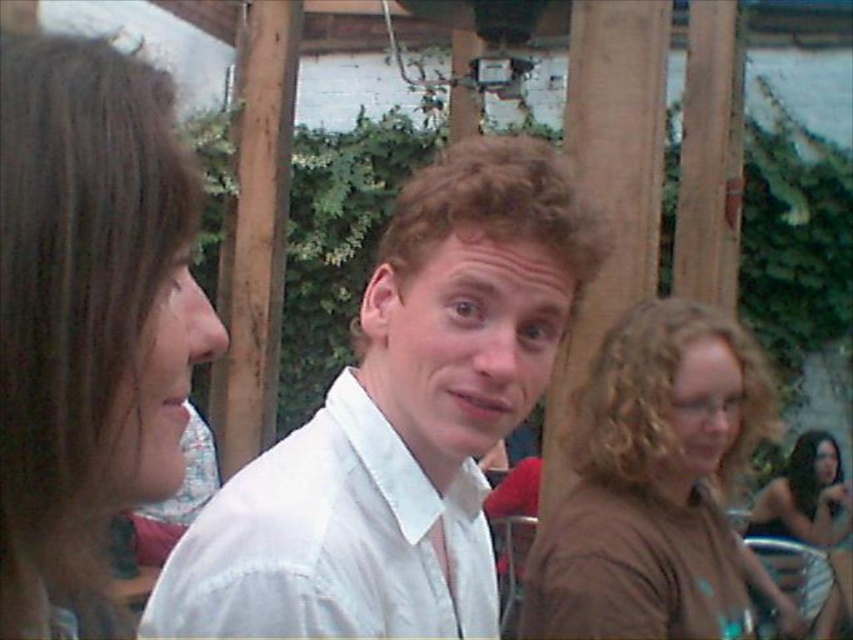
Is brown hair at left further to camera compared to brown matte shirt at center?

No, it is not.

Is brown hair at left bigger than brown matte shirt at center?

Yes.

Locate an element on the screen. The image size is (853, 640). brown hair at left is located at coordinates (88, 321).

You are a GUI agent. You are given a task and a screenshot of the screen. Output one action in this format:
    pyautogui.click(x=<x>, y=<y>)
    Task: Click on the brown hair at left
    The image size is (853, 640).
    Given the screenshot: What is the action you would take?
    pyautogui.click(x=88, y=321)

Who is positioned more to the right, curly blonde hair at right or brown curly hair at upper right?

Positioned to the right is brown curly hair at upper right.

Is point (646, 426) farther from viewer compared to point (815, 477)?

No, (646, 426) is in front of (815, 477).

Find the location of a particular element. curly blonde hair at right is located at coordinates (660, 392).

Does white cotton shirt at center have a larger size compared to brown matte shirt at center?

No.

Does point (544, 280) lie behind point (625, 410)?

No, (544, 280) is closer to viewer.

The height and width of the screenshot is (640, 853). Identify the location of white cotton shirt at center. (401, 420).